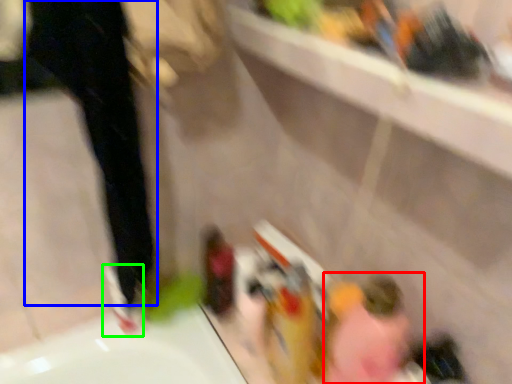
Question: Estimate the real-world distances between objects in this image. Which object is closer to woman (highlighted by a red box), pants (highlighted by a blue box) or shoe (highlighted by a green box)?

Choices:
 (A) pants
 (B) shoe

Answer: (B)